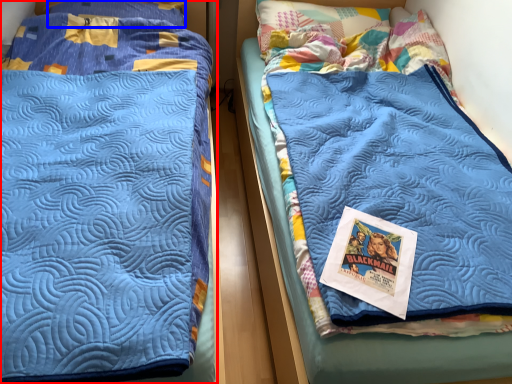
Question: Which of the following is the closest to the observer, bed (highlighted by a red box) or pillow (highlighted by a blue box)?

Choices:
 (A) bed
 (B) pillow

Answer: (A)